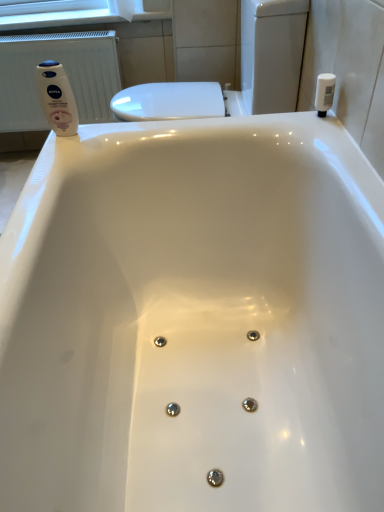
Question: From a real-world perspective, is white matte toilet paper at upper left physically below white plastic bottle at upper right, marked as the first toiletry in a right-to-left arrangement?

Choices:
 (A) no
 (B) yes

Answer: (A)

Question: Does white matte toilet paper at upper left lie in front of white plastic bottle at upper right, marked as the first toiletry in a right-to-left arrangement?

Choices:
 (A) yes
 (B) no

Answer: (B)

Question: Is white matte toilet paper at upper left bigger than white plastic bottle at upper right, marked as the first toiletry in a right-to-left arrangement?

Choices:
 (A) no
 (B) yes

Answer: (B)

Question: Considering the relative sizes of white matte toilet paper at upper left and white plastic bottle at upper right, which appears as the 2th toiletry when viewed from the left, in the image provided, is white matte toilet paper at upper left taller than white plastic bottle at upper right, which appears as the 2th toiletry when viewed from the left,?

Choices:
 (A) no
 (B) yes

Answer: (B)

Question: Considering the relative sizes of white matte toilet paper at upper left and white plastic bottle at upper right, which appears as the 2th toiletry when viewed from the left, in the image provided, is white matte toilet paper at upper left shorter than white plastic bottle at upper right, which appears as the 2th toiletry when viewed from the left,?

Choices:
 (A) yes
 (B) no

Answer: (B)

Question: Is white matte toilet paper at upper left next to white plastic bottle at upper right, which appears as the 2th toiletry when viewed from the left?

Choices:
 (A) no
 (B) yes

Answer: (A)

Question: Would you say white plastic radiator at left is outside white matte toilet paper at upper left?

Choices:
 (A) yes
 (B) no

Answer: (A)

Question: Is white plastic radiator at left to the left of white matte toilet paper at upper left from the viewer's perspective?

Choices:
 (A) yes
 (B) no

Answer: (A)

Question: Is white plastic radiator at left bigger than white matte toilet paper at upper left?

Choices:
 (A) yes
 (B) no

Answer: (A)

Question: Considering the relative sizes of white plastic radiator at left and white matte toilet paper at upper left in the image provided, is white plastic radiator at left smaller than white matte toilet paper at upper left?

Choices:
 (A) yes
 (B) no

Answer: (B)

Question: Considering the relative sizes of white plastic radiator at left and white matte toilet paper at upper left in the image provided, is white plastic radiator at left thinner than white matte toilet paper at upper left?

Choices:
 (A) yes
 (B) no

Answer: (A)

Question: From the image's perspective, is white plastic radiator at left above white matte toilet paper at upper left?

Choices:
 (A) yes
 (B) no

Answer: (B)

Question: Is white matte lotion at upper left, the second toiletry when ordered from right to left, to the left of white plastic bottle at upper right, which appears as the 2th toiletry when viewed from the left, from the viewer's perspective?

Choices:
 (A) yes
 (B) no

Answer: (A)